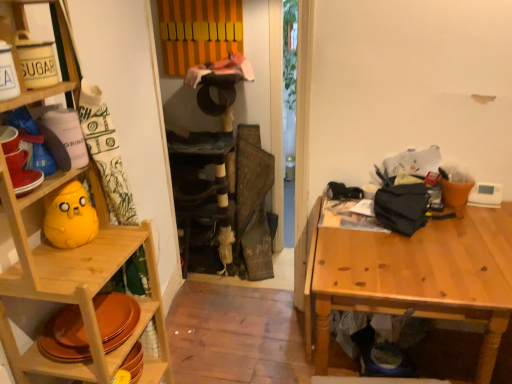
Question: Is wooden shelf at left taller than wooden table at right?

Choices:
 (A) yes
 (B) no

Answer: (A)

Question: Does wooden shelf at left have a larger size compared to wooden table at right?

Choices:
 (A) no
 (B) yes

Answer: (A)

Question: Does wooden shelf at left appear on the left side of wooden table at right?

Choices:
 (A) yes
 (B) no

Answer: (A)

Question: From a real-world perspective, is wooden shelf at left on top of wooden table at right?

Choices:
 (A) no
 (B) yes

Answer: (B)

Question: Does wooden shelf at left lie behind wooden table at right?

Choices:
 (A) no
 (B) yes

Answer: (A)

Question: Is point (389, 299) positioned closer to the camera than point (168, 226)?

Choices:
 (A) farther
 (B) closer

Answer: (B)

Question: From the image's perspective, relative to wooden shelf at left, is wooden table at right above or below?

Choices:
 (A) below
 (B) above

Answer: (A)

Question: Is wooden table at right in front of or behind wooden shelf at left in the image?

Choices:
 (A) front
 (B) behind

Answer: (B)

Question: Based on their sizes in the image, would you say wooden table at right is bigger or smaller than wooden shelf at left?

Choices:
 (A) big
 (B) small

Answer: (A)

Question: Considering the positions of wooden shelf at left and wooden table at right in the image, is wooden shelf at left taller or shorter than wooden table at right?

Choices:
 (A) short
 (B) tall

Answer: (B)

Question: In terms of width, does wooden shelf at left look wider or thinner when compared to wooden table at right?

Choices:
 (A) wide
 (B) thin

Answer: (B)

Question: From a real-world perspective, is wooden shelf at left above or below wooden table at right?

Choices:
 (A) above
 (B) below

Answer: (A)

Question: Is wooden shelf at left bigger or smaller than wooden table at right?

Choices:
 (A) big
 (B) small

Answer: (B)

Question: Looking at the image, does wooden table at right seem bigger or smaller compared to matte yellow plush at left?

Choices:
 (A) big
 (B) small

Answer: (A)

Question: Would you say wooden table at right is to the left or to the right of matte yellow plush at left in the picture?

Choices:
 (A) right
 (B) left

Answer: (A)